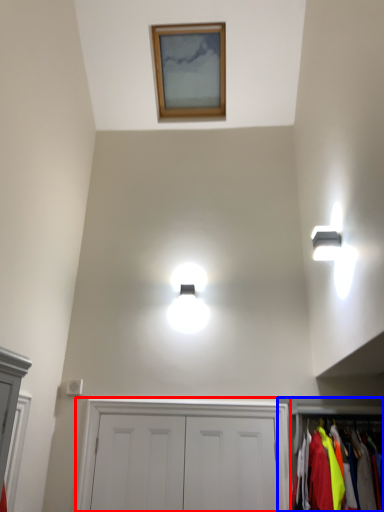
Question: Among these objects, which one is nearest to the camera, dresser (highlighted by a red box) or dresser (highlighted by a blue box)?

Choices:
 (A) dresser
 (B) dresser

Answer: (B)